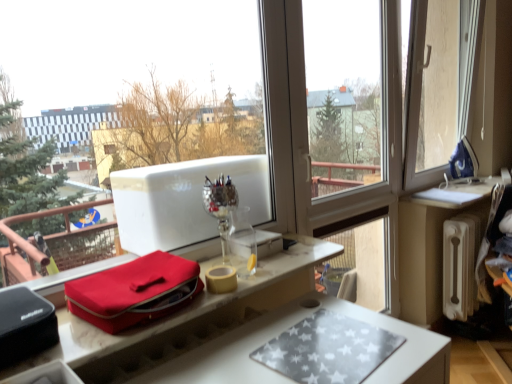
What do you see at coordinates (221, 206) in the screenshot? I see `silver reflective wine glass at center` at bounding box center [221, 206].

The height and width of the screenshot is (384, 512). I want to click on blue fabric iron at upper right, so click(463, 161).

Find the location of a particular element. Image resolution: width=512 pixels, height=384 pixels. white radiator at right is located at coordinates (431, 244).

Based on the photo, what is the approximate width of white radiator at right?

7.34 inches.

In order to face matte red bag at center, should I rotate leftwards or rightwards?

It's best to rotate left around 14.957 degrees.

This screenshot has height=384, width=512. What are the coordinates of `matte red bag at center` in the screenshot? It's located at (184, 319).

Is matte red bag at center at the left side of silver reflective wine glass at center?

Yes.

Where is `desk below the silver reflective wine glass at center (from the image's perspective)`? This screenshot has height=384, width=512. desk below the silver reflective wine glass at center (from the image's perspective) is located at coordinates (184, 319).

Is matte red bag at center looking in the opposite direction of silver reflective wine glass at center?

No, matte red bag at center's orientation is not away from silver reflective wine glass at center.

Is silver reflective wine glass at center wider or thinner than matte red bag at center?

Considering their sizes, silver reflective wine glass at center looks slimmer than matte red bag at center.

Is silver reflective wine glass at center looking in the opposite direction of matte red bag at center?

No, silver reflective wine glass at center is not facing away from matte red bag at center.

Based on the photo, which is more to the left, silver reflective wine glass at center or matte red bag at center?

matte red bag at center.

In order to click on wine glass above the matte red bag at center (from the image's perspective) in this screenshot , I will do `click(221, 206)`.

Can you tell me how much matte red bag at center and silver reflective wine glass at center differ in facing direction?

The angular difference between matte red bag at center and silver reflective wine glass at center is 7.97 degrees.

Considering the points (129, 289) and (237, 203), which point is behind, point (129, 289) or point (237, 203)?

Positioned behind is point (237, 203).

Is matte red bag at center wider or thinner than silver reflective wine glass at center?

Clearly, matte red bag at center has more width compared to silver reflective wine glass at center.

Which of these two, white radiator at right or blue fabric iron at upper right, is smaller?

blue fabric iron at upper right is smaller.

From their relative heights in the image, would you say white radiator at right is taller or shorter than blue fabric iron at upper right?

In the image, white radiator at right appears to be taller than blue fabric iron at upper right.

Is point (430, 277) positioned after point (459, 176)?

No, it is in front of (459, 176).

Locate an element on the screen. This screenshot has height=384, width=512. table below the blue fabric iron at upper right (from the image's perspective) is located at coordinates (431, 244).

In the scene shown: Between matte red bag at center and white radiator at right, which one is positioned in front?

matte red bag at center is more forward.

Is matte red bag at center beside white radiator at right?

matte red bag at center and white radiator at right are clearly separated.

Considering the relative positions of matte red bag at center and white radiator at right in the image provided, is matte red bag at center to the left of white radiator at right from the viewer's perspective?

Yes.

How many degrees apart are the facing directions of matte red bag at center and white radiator at right?

There is a 10-degree angle between the facing directions of matte red bag at center and white radiator at right.

Is blue fabric iron at upper right turned away from silver reflective wine glass at center?

blue fabric iron at upper right does not have its back to silver reflective wine glass at center.

Relative to silver reflective wine glass at center, is blue fabric iron at upper right in front or behind?

blue fabric iron at upper right is behind silver reflective wine glass at center.

Does blue fabric iron at upper right have a greater height compared to silver reflective wine glass at center?

In fact, blue fabric iron at upper right may be shorter than silver reflective wine glass at center.

How distant is blue fabric iron at upper right from silver reflective wine glass at center?

They are 1.76 meters apart.

Measure the distance from silver reflective wine glass at center to matte red bag at center.

They are 30.60 centimeters apart.

Could you tell me if silver reflective wine glass at center is facing matte red bag at center?

No, silver reflective wine glass at center does not turn towards matte red bag at center.

From a real-world perspective, is silver reflective wine glass at center on matte red bag at center?

Indeed, from a real-world perspective, silver reflective wine glass at center stands above matte red bag at center.

In the image, is silver reflective wine glass at center positioned in front of or behind matte red bag at center?

Clearly, silver reflective wine glass at center is behind matte red bag at center.

Identify the location of wine glass behind the matte red bag at center. The width and height of the screenshot is (512, 384). (221, 206).

This screenshot has width=512, height=384. What are the coordinates of `wine glass above the matte red bag at center (from the image's perspective)` in the screenshot? It's located at (221, 206).

Looking at the image, which one is located further to matte red bag at center, blue fabric iron at upper right or matte red bag at center?

blue fabric iron at upper right is further to matte red bag at center.

Based on their spatial positions, is white radiator at right or blue fabric iron at upper right further from matte red bag at center?

blue fabric iron at upper right is further to matte red bag at center.

Looking at the image, which one is located further to silver reflective wine glass at center, matte red bag at center or blue fabric iron at upper right?

Based on the image, blue fabric iron at upper right appears to be further to silver reflective wine glass at center.

Which object lies further to the anchor point silver reflective wine glass at center, matte red bag at center or matte red bag at center?

matte red bag at center lies further to silver reflective wine glass at center than the other object.

Estimate the real-world distances between objects in this image. Which object is closer to matte red bag at center, white radiator at right or matte red bag at center?

Based on the image, matte red bag at center appears to be nearer to matte red bag at center.

Considering their positions, is white radiator at right positioned further to matte red bag at center than silver reflective wine glass at center?

Among the two, white radiator at right is located further to matte red bag at center.

Based on their spatial positions, is blue fabric iron at upper right or matte red bag at center closer to white radiator at right?

blue fabric iron at upper right lies closer to white radiator at right than the other object.

From the image, which object appears to be farther from blue fabric iron at upper right, white radiator at right or matte red bag at center?

Among the two, matte red bag at center is located further to blue fabric iron at upper right.

The width and height of the screenshot is (512, 384). I want to click on desk between matte red bag at center and blue fabric iron at upper right from left to right, so click(x=184, y=319).

Locate an element on the screen. This screenshot has height=384, width=512. appliance between silver reflective wine glass at center and white radiator at right from left to right is located at coordinates (463, 161).

Locate an element on the screen. appliance located between matte red bag at center and white radiator at right in the left-right direction is located at coordinates (463, 161).

The height and width of the screenshot is (384, 512). I want to click on wine glass located between matte red bag at center and blue fabric iron at upper right in the left-right direction, so click(221, 206).